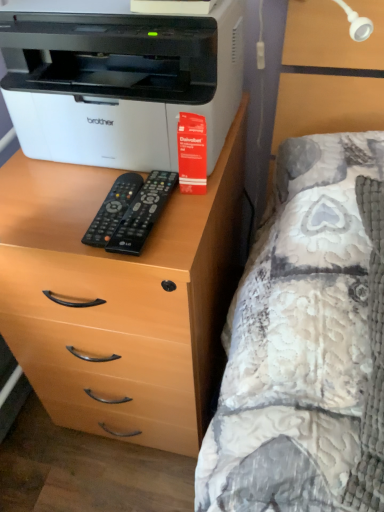
You are a GUI agent. You are given a task and a screenshot of the screen. Output one action in this format:
    pyautogui.click(x=<x>, y=<y>)
    Task: Click on the free space to the left of black plastic remote at center, arranged as the second remote when viewed from the right
    This screenshot has width=384, height=512.
    Given the screenshot: What is the action you would take?
    pyautogui.click(x=48, y=209)